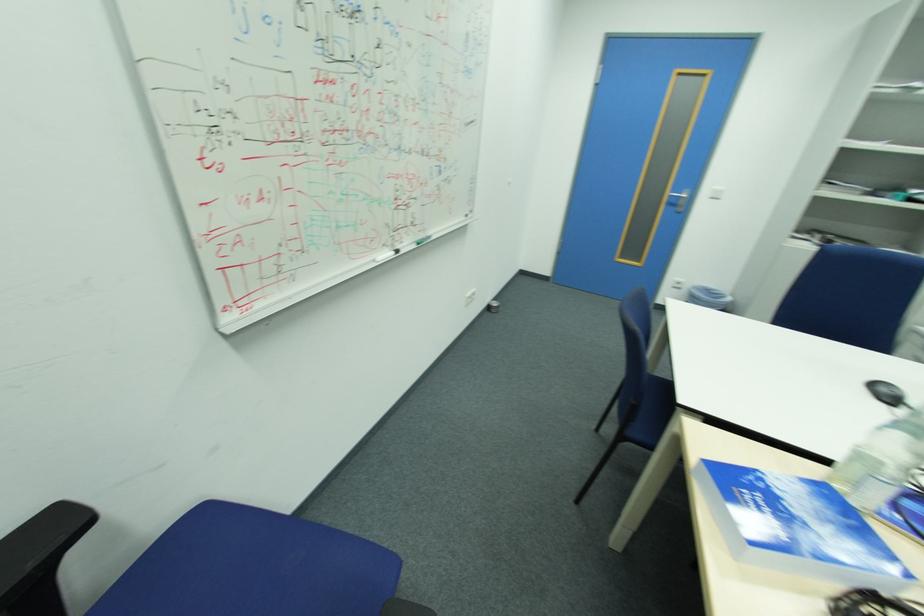
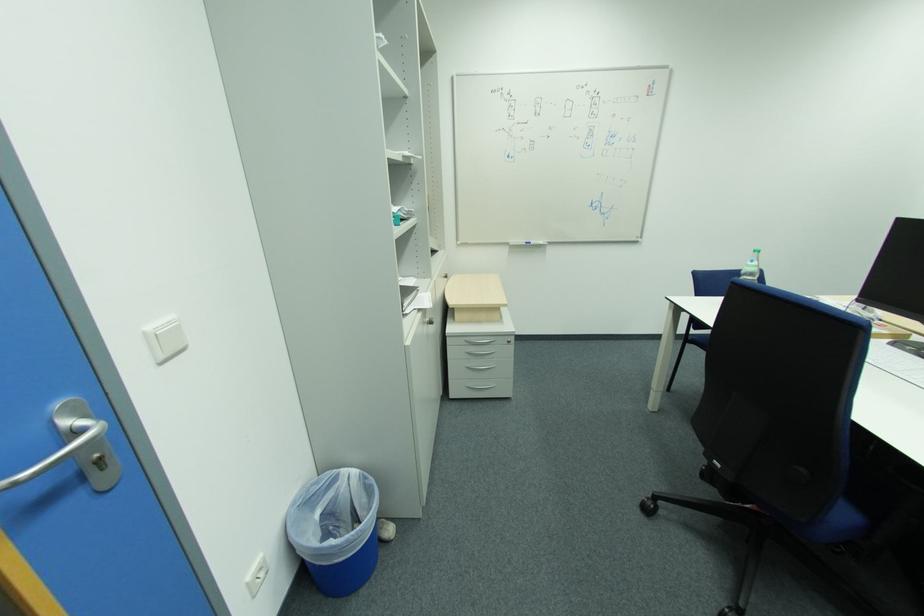
The point at (723, 188) is marked in the first image. Where is the corresponding point in the second image?

(154, 329)